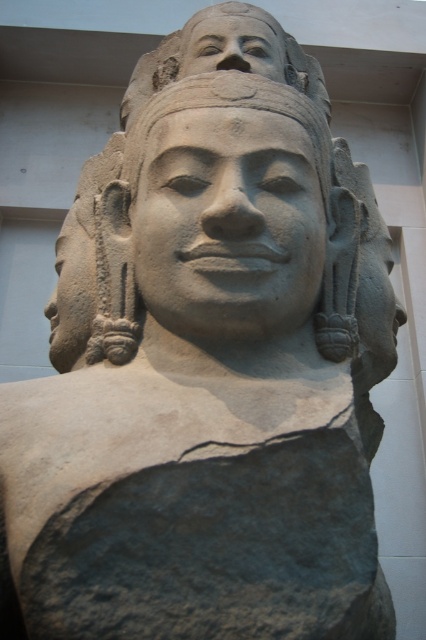
Consider the image. Based on the description, which object has a greater height between the matte stone ear at left and the smooth stone face at upper center?

The matte stone ear at left has a greater height compared to the smooth stone face at upper center.

You are an art conservator examining the sculpture. You need to document the positions of the gray stone face at center and the smooth stone face at upper center. Which one is positioned to the left of the other?

The gray stone face at center is positioned to the left of the smooth stone face at upper center.